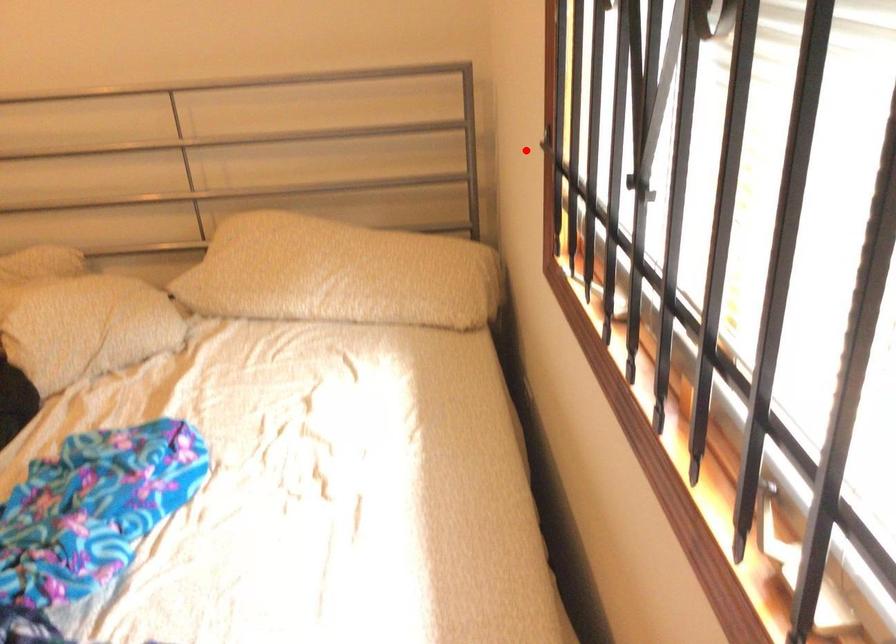
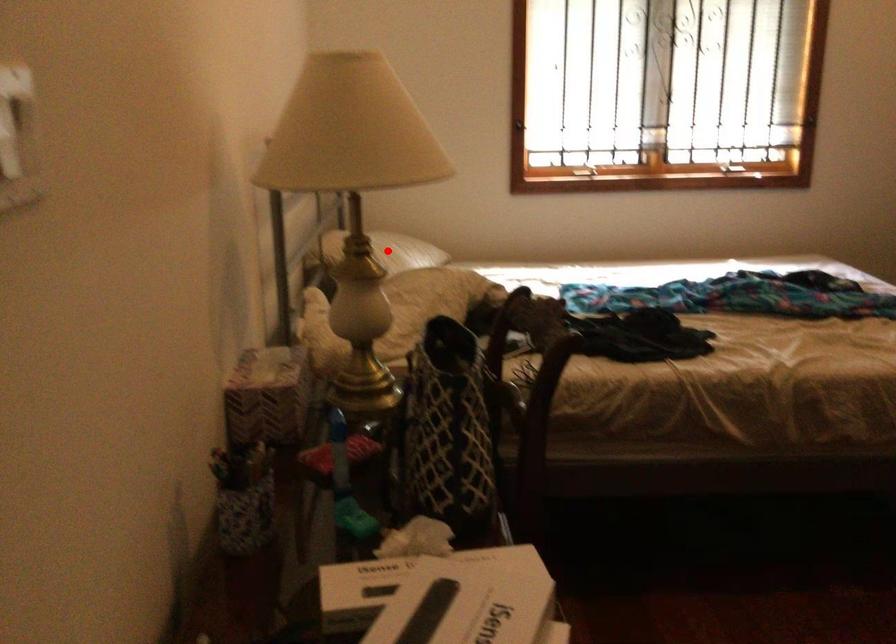
I am providing you with two images of the same scene from different viewpoints. A red point is marked on the first image and another point is marked on the second image. Is the red point in image1 aligned with the point shown in image2?

No